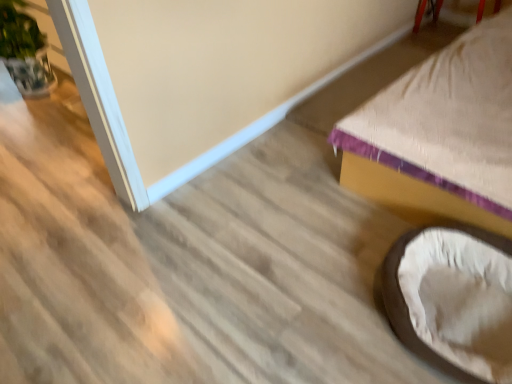
Question: From a real-world perspective, is green leafy plant at left located beneath soft beige fabric bean bag chair at lower right?

Choices:
 (A) yes
 (B) no

Answer: (B)

Question: Does green leafy plant at left come in front of soft beige fabric bean bag chair at lower right?

Choices:
 (A) no
 (B) yes

Answer: (A)

Question: Can you confirm if green leafy plant at left is shorter than soft beige fabric bean bag chair at lower right?

Choices:
 (A) no
 (B) yes

Answer: (A)

Question: Is green leafy plant at left located outside soft beige fabric bean bag chair at lower right?

Choices:
 (A) no
 (B) yes

Answer: (B)

Question: From a real-world perspective, does green leafy plant at left stand above soft beige fabric bean bag chair at lower right?

Choices:
 (A) no
 (B) yes

Answer: (B)

Question: Considering the positions of point (445, 82) and point (10, 41), is point (445, 82) closer or farther from the camera than point (10, 41)?

Choices:
 (A) closer
 (B) farther

Answer: (A)

Question: Is beige fabric bed at lower right in front of or behind green leafy plant at left in the image?

Choices:
 (A) behind
 (B) front

Answer: (B)

Question: Looking at their shapes, would you say beige fabric bed at lower right is wider or thinner than green leafy plant at left?

Choices:
 (A) thin
 (B) wide

Answer: (B)

Question: Based on their sizes in the image, would you say beige fabric bed at lower right is bigger or smaller than green leafy plant at left?

Choices:
 (A) small
 (B) big

Answer: (B)

Question: Based on their sizes in the image, would you say beige fabric bed at lower right is bigger or smaller than soft beige fabric bean bag chair at lower right?

Choices:
 (A) small
 (B) big

Answer: (B)

Question: From a real-world perspective, relative to soft beige fabric bean bag chair at lower right, is beige fabric bed at lower right vertically above or below?

Choices:
 (A) above
 (B) below

Answer: (A)

Question: Visually, is beige fabric bed at lower right positioned to the left or to the right of soft beige fabric bean bag chair at lower right?

Choices:
 (A) right
 (B) left

Answer: (A)

Question: In terms of height, does beige fabric bed at lower right look taller or shorter compared to soft beige fabric bean bag chair at lower right?

Choices:
 (A) tall
 (B) short

Answer: (A)

Question: Do you think soft beige fabric bean bag chair at lower right is within green leafy plant at left, or outside of it?

Choices:
 (A) inside
 (B) outside

Answer: (B)

Question: Is soft beige fabric bean bag chair at lower right in front of or behind green leafy plant at left in the image?

Choices:
 (A) behind
 (B) front

Answer: (B)